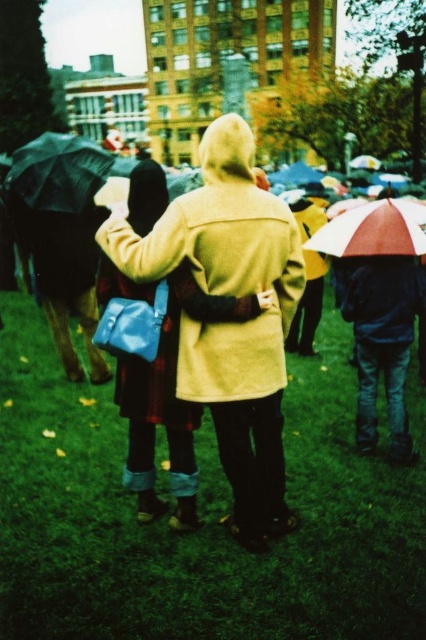
Question: Is green grass at center to the right of matte black umbrella at left from the viewer's perspective?

Choices:
 (A) yes
 (B) no

Answer: (A)

Question: Can you confirm if matte yellow trench coat at center is positioned to the left of translucent plastic umbrella at right?

Choices:
 (A) yes
 (B) no

Answer: (A)

Question: Which object appears farthest from the camera in this image?

Choices:
 (A) matte yellow trench coat at center
 (B) green grass at center

Answer: (A)

Question: Considering the real-world distances, which object is farthest from the translucent plastic umbrella at right?

Choices:
 (A) matte black umbrella at left
 (B) matte yellow trench coat at center

Answer: (A)

Question: Can you confirm if matte black umbrella at left is bigger than translucent plastic umbrella at right?

Choices:
 (A) no
 (B) yes

Answer: (B)

Question: Which of these objects is positioned closest to the green grass at center?

Choices:
 (A) matte yellow trench coat at center
 (B) translucent plastic umbrella at right
 (C) matte black umbrella at left

Answer: (A)